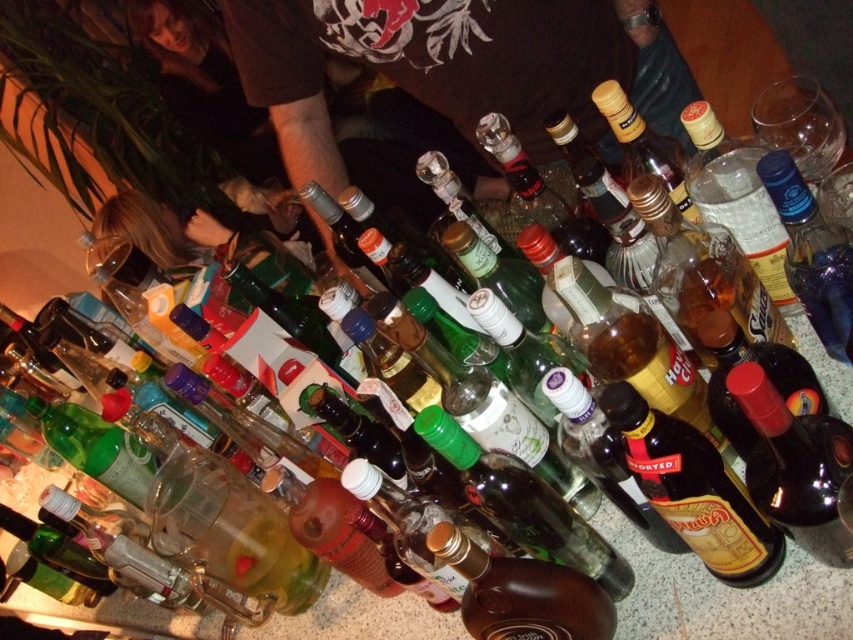
Can you confirm if amber glass bottle at center is smaller than shiny dark red bottle at center?

Actually, amber glass bottle at center might be larger than shiny dark red bottle at center.

In the scene shown: Which of these two, amber glass bottle at center or shiny dark red bottle at center, stands shorter?

shiny dark red bottle at center is shorter.

Image resolution: width=853 pixels, height=640 pixels. What do you see at coordinates (694, 490) in the screenshot? I see `amber glass bottle at center` at bounding box center [694, 490].

Locate an element on the screen. This screenshot has width=853, height=640. amber glass bottle at center is located at coordinates (694, 490).

Who is taller, shiny dark red bottle at center or brown glass bottle at center?

shiny dark red bottle at center is taller.

What do you see at coordinates (795, 465) in the screenshot? This screenshot has width=853, height=640. I see `shiny dark red bottle at center` at bounding box center [795, 465].

I want to click on shiny dark red bottle at center, so click(x=795, y=465).

Where is `shiny dark red bottle at center`? shiny dark red bottle at center is located at coordinates (795, 465).

Which of these two, black t-shirt at center or shiny dark red bottle at center, stands taller?

With more height is black t-shirt at center.

Which is more to the left, black t-shirt at center or shiny dark red bottle at center?

Positioned to the left is black t-shirt at center.

Is point (345, 32) less distant than point (767, 438)?

No, (345, 32) is further to viewer.

I want to click on black t-shirt at center, so click(456, 65).